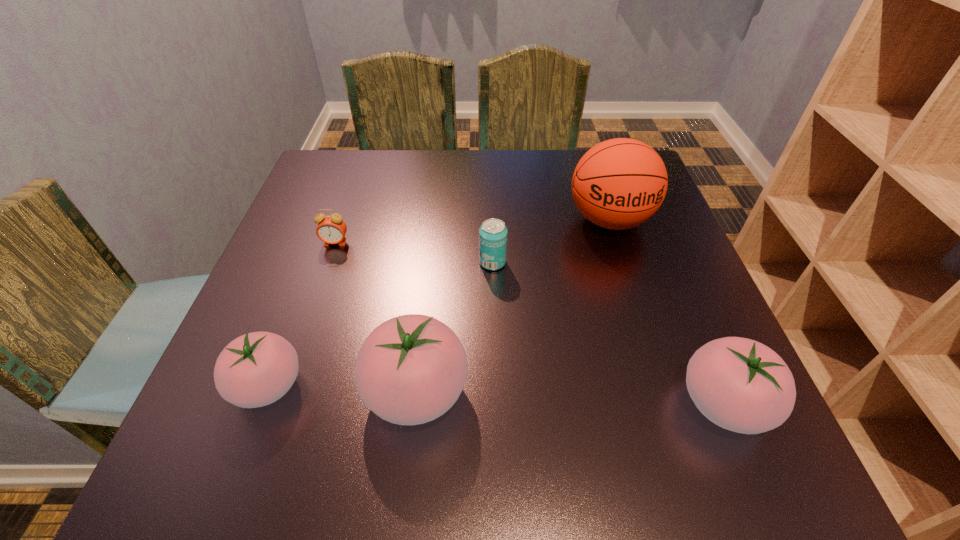
Find the location of a particular element. This screenshot has height=540, width=960. object that is at the far right corner is located at coordinates (618, 184).

Identify the location of object at the near right corner. Image resolution: width=960 pixels, height=540 pixels. (739, 384).

Locate an element on the screen. vacant space at the far edge of the desktop is located at coordinates (396, 151).

In the image, there is a desktop. Identify the location of vacant space at the near edge. The height and width of the screenshot is (540, 960). (577, 384).

In the image, there is a desktop. At what (x,y) coordinates should I click in order to perform the action: click on free space at the left edge. Please return your answer as a coordinate pair (x, y). The height and width of the screenshot is (540, 960). Looking at the image, I should click on (297, 304).

At what (x,y) coordinates should I click in order to perform the action: click on vacant region at the right edge. Please return your answer as a coordinate pair (x, y). Image resolution: width=960 pixels, height=540 pixels. Looking at the image, I should click on (637, 248).

The image size is (960, 540). I want to click on vacant region at the far left corner of the desktop, so 356,192.

The image size is (960, 540). Find the location of `vacant space at the near left corner of the desktop`. vacant space at the near left corner of the desktop is located at coordinates (228, 418).

Find the location of a particular element. Image resolution: width=960 pixels, height=540 pixels. free space between the basketball and the second tomato from right to left is located at coordinates (513, 306).

Find the location of `vacant space that is in between the basketball and the fourth nearest object`. vacant space that is in between the basketball and the fourth nearest object is located at coordinates (551, 241).